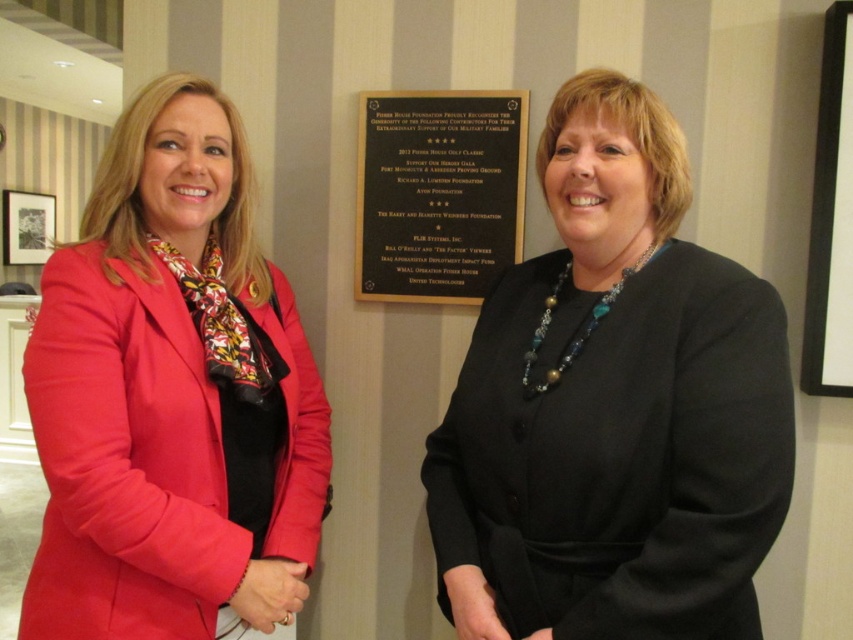
Can you confirm if matte pink blazer at left is wider than gold metallic plaque at center?

Indeed, matte pink blazer at left has a greater width compared to gold metallic plaque at center.

Is matte pink blazer at left taller than gold metallic plaque at center?

Indeed, matte pink blazer at left has a greater height compared to gold metallic plaque at center.

This screenshot has width=853, height=640. What do you see at coordinates (171, 394) in the screenshot?
I see `matte pink blazer at left` at bounding box center [171, 394].

Locate an element on the screen. matte pink blazer at left is located at coordinates point(171,394).

Who is taller, black matte blazer at center or gold metallic plaque at center?

Standing taller between the two is black matte blazer at center.

Does point (730, 369) come behind point (403, 188)?

No, it is in front of (403, 188).

Where is `black matte blazer at center`? The width and height of the screenshot is (853, 640). black matte blazer at center is located at coordinates (613, 406).

Is matte pink blazer at left to the right of white glossy board at upper right from the viewer's perspective?

In fact, matte pink blazer at left is to the left of white glossy board at upper right.

Looking at this image, which of these two, matte pink blazer at left or white glossy board at upper right, stands taller?

Standing taller between the two is matte pink blazer at left.

Who is more forward, (49, 388) or (799, 364)?

Point (49, 388)

At what (x,y) coordinates should I click in order to perform the action: click on matte pink blazer at left. Please return your answer as a coordinate pair (x, y). The width and height of the screenshot is (853, 640). Looking at the image, I should click on (171, 394).